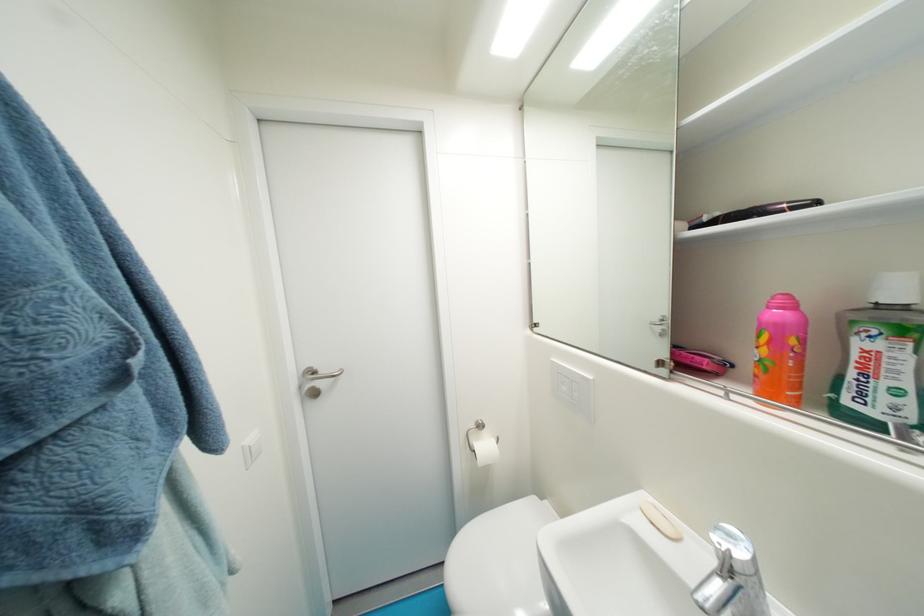
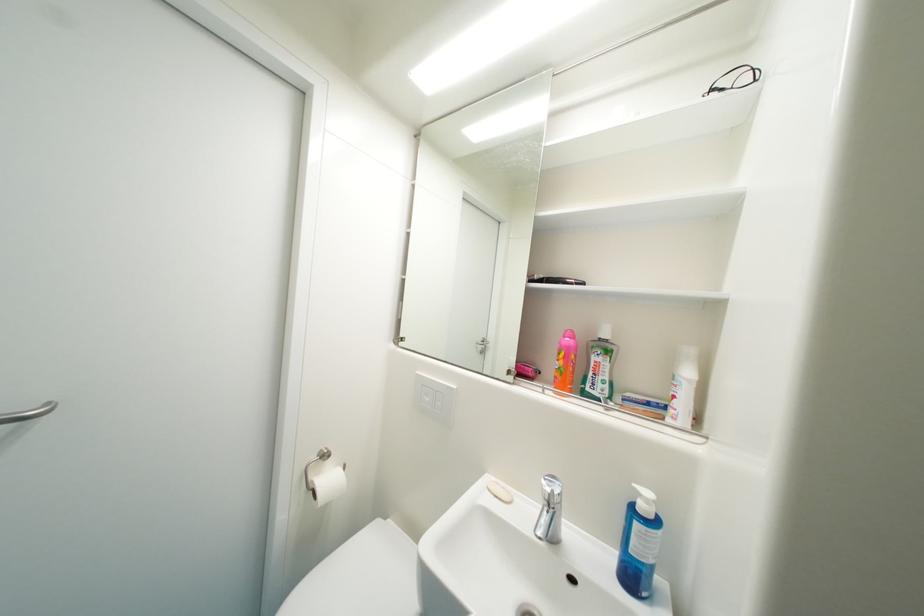
In the second image, find the point that corresponds to the point at 858,376 in the first image.

(598, 376)